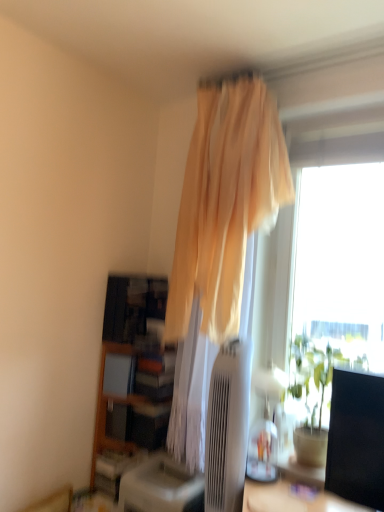
Question: Can you confirm if wooden bookshelf at lower left is wider than beige sheer curtain at upper center?

Choices:
 (A) no
 (B) yes

Answer: (A)

Question: Is wooden bookshelf at lower left at the left side of beige sheer curtain at upper center?

Choices:
 (A) yes
 (B) no

Answer: (A)

Question: From the image's perspective, is wooden bookshelf at lower left on beige sheer curtain at upper center?

Choices:
 (A) yes
 (B) no

Answer: (B)

Question: Is the depth of wooden bookshelf at lower left greater than that of beige sheer curtain at upper center?

Choices:
 (A) yes
 (B) no

Answer: (A)

Question: Is wooden bookshelf at lower left looking in the opposite direction of beige sheer curtain at upper center?

Choices:
 (A) yes
 (B) no

Answer: (B)

Question: Is wooden bookshelf at lower left bigger or smaller than satin beige air conditioner at center?

Choices:
 (A) big
 (B) small

Answer: (A)

Question: From their relative heights in the image, would you say wooden bookshelf at lower left is taller or shorter than satin beige air conditioner at center?

Choices:
 (A) short
 (B) tall

Answer: (A)

Question: Does point (117, 346) appear closer or farther from the camera than point (236, 434)?

Choices:
 (A) farther
 (B) closer

Answer: (A)

Question: Is wooden bookshelf at lower left inside or outside of satin beige air conditioner at center?

Choices:
 (A) outside
 (B) inside

Answer: (A)

Question: Is green leafy plant at right inside the boundaries of beige sheer curtain at upper center, or outside?

Choices:
 (A) inside
 (B) outside

Answer: (B)

Question: In terms of width, does green leafy plant at right look wider or thinner when compared to beige sheer curtain at upper center?

Choices:
 (A) wide
 (B) thin

Answer: (B)

Question: Relative to beige sheer curtain at upper center, is green leafy plant at right in front or behind?

Choices:
 (A) front
 (B) behind

Answer: (A)

Question: Does point (302, 444) appear closer or farther from the camera than point (243, 189)?

Choices:
 (A) farther
 (B) closer

Answer: (B)

Question: Considering the positions of point (306, 375) and point (109, 298), is point (306, 375) closer or farther from the camera than point (109, 298)?

Choices:
 (A) closer
 (B) farther

Answer: (A)

Question: Relative to wooden bookshelf at lower left, is green leafy plant at right in front or behind?

Choices:
 (A) front
 (B) behind

Answer: (A)